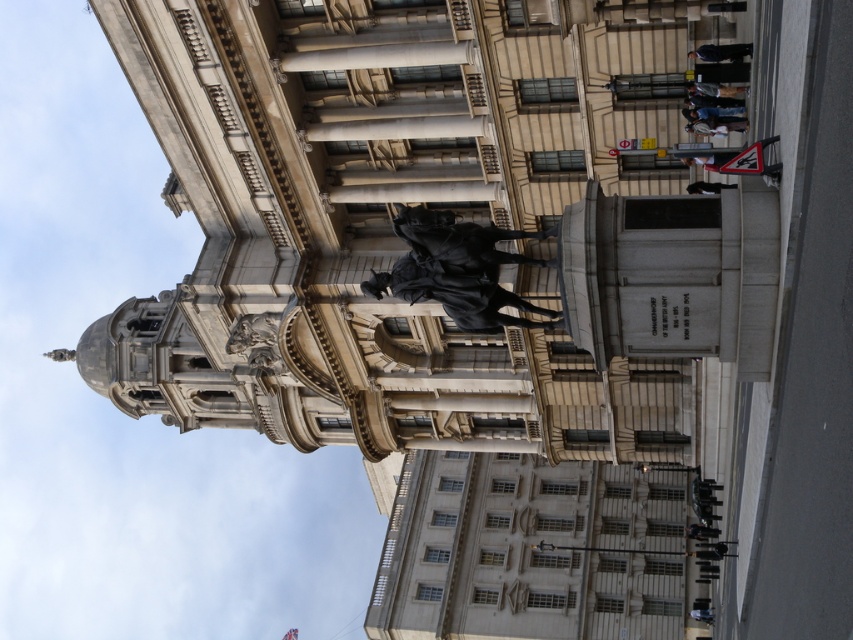
Question: Which object is the closest to the dark gray stone statue at center?

Choices:
 (A) black polished statue at center
 (B) dark brown leather jacket at upper right
 (C) leather jacket at right

Answer: (B)

Question: Does black leather jacket at upper right have a greater width compared to black fabric at lower right?

Choices:
 (A) yes
 (B) no

Answer: (B)

Question: Considering the relative positions of leather jacket at right and black fabric at lower right in the image provided, where is leather jacket at right located with respect to black fabric at lower right?

Choices:
 (A) left
 (B) right

Answer: (B)

Question: Which object is the farthest from the black polished statue at center?

Choices:
 (A) black leather jacket at upper right
 (B) black fabric at lower right

Answer: (A)

Question: Among these points, which one is nearest to the camera?

Choices:
 (A) (509, 301)
 (B) (714, 122)
 (C) (706, 182)

Answer: (A)

Question: Does polished bronze statue at center appear on the left side of black leather jacket at upper right?

Choices:
 (A) no
 (B) yes

Answer: (B)